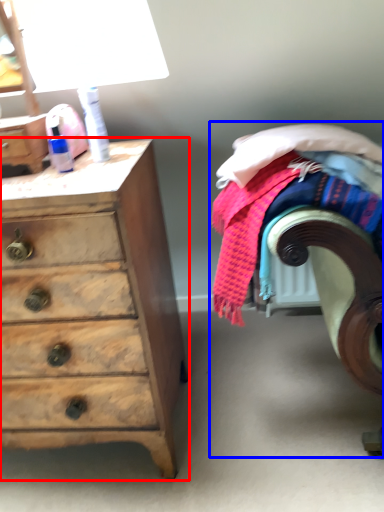
Question: Which of the following is the closest to the observer, chest of drawers (highlighted by a red box) or bed (highlighted by a blue box)?

Choices:
 (A) chest of drawers
 (B) bed

Answer: (B)